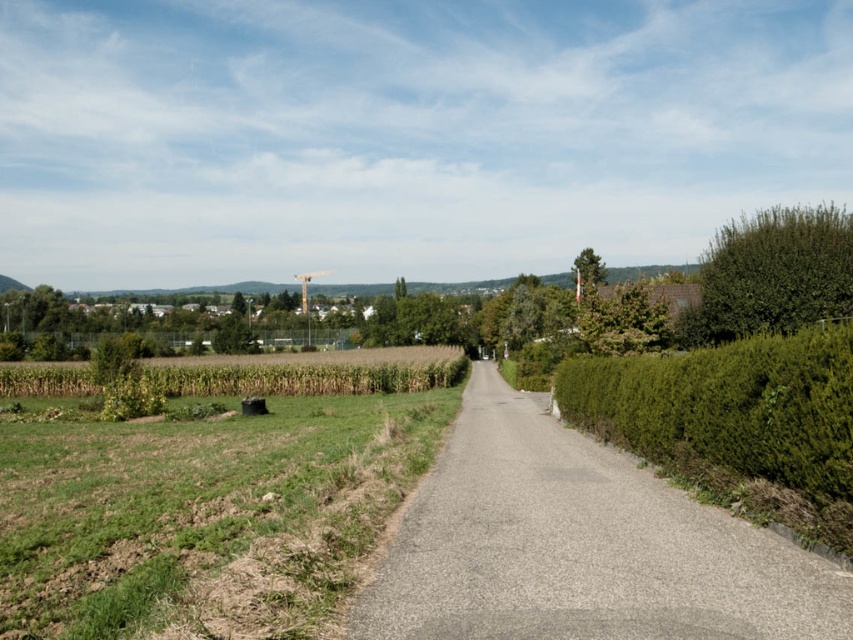
Question: Among these objects, which one is farthest from the camera?

Choices:
 (A) green grassy field at left
 (B) green leafy tree at upper center
 (C) gray asphalt road at center
 (D) green leafy bush at right

Answer: (B)

Question: Can you confirm if green grassy field at left is wider than green leafy hedge at right?

Choices:
 (A) yes
 (B) no

Answer: (A)

Question: Which of the following is the closest to the observer?

Choices:
 (A) green leafy bush at right
 (B) green leafy tree at upper center
 (C) gray asphalt road at center
 (D) green leafy hedge at right

Answer: (C)

Question: Which object is the closest to the green leafy hedge at right?

Choices:
 (A) green leafy bush at right
 (B) green leafy tree at upper center

Answer: (A)

Question: Can you confirm if gray asphalt road at center is thinner than green leafy tree at upper center?

Choices:
 (A) no
 (B) yes

Answer: (B)

Question: Does green leafy hedge at right appear on the left side of green leafy tree at upper center?

Choices:
 (A) yes
 (B) no

Answer: (A)